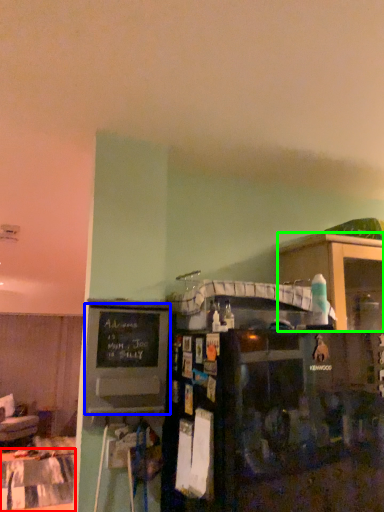
Question: Which object is the farthest from table (highlighted by a red box)? Choose among these: bulletin board (highlighted by a blue box) or shelf (highlighted by a green box).

Choices:
 (A) bulletin board
 (B) shelf

Answer: (B)